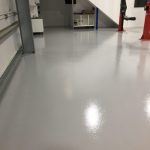
You are a GUI agent. You are given a task and a screenshot of the screen. Output one action in this format:
    pyautogui.click(x=<x>, y=<y>)
    Task: Click on the television screen
    This screenshot has width=150, height=150.
    Given the screenshot: What is the action you would take?
    pyautogui.click(x=69, y=1), pyautogui.click(x=69, y=87)